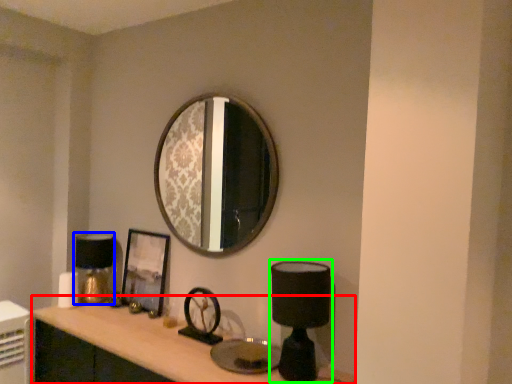
Question: Which object is the closest to the computer desk (highlighted by a red box)? Choose among these: table lamp (highlighted by a blue box) or table lamp (highlighted by a green box).

Choices:
 (A) table lamp
 (B) table lamp

Answer: (A)